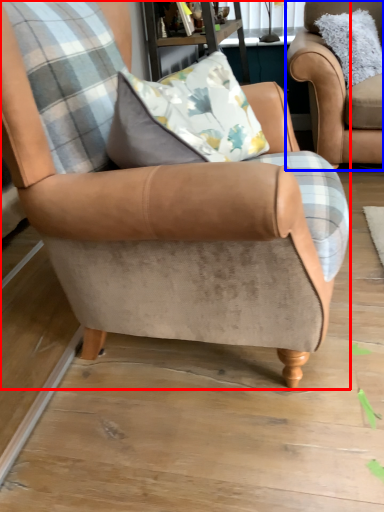
Question: Which object appears farthest to the camera in this image, chair (highlighted by a red box) or chair (highlighted by a blue box)?

Choices:
 (A) chair
 (B) chair

Answer: (B)